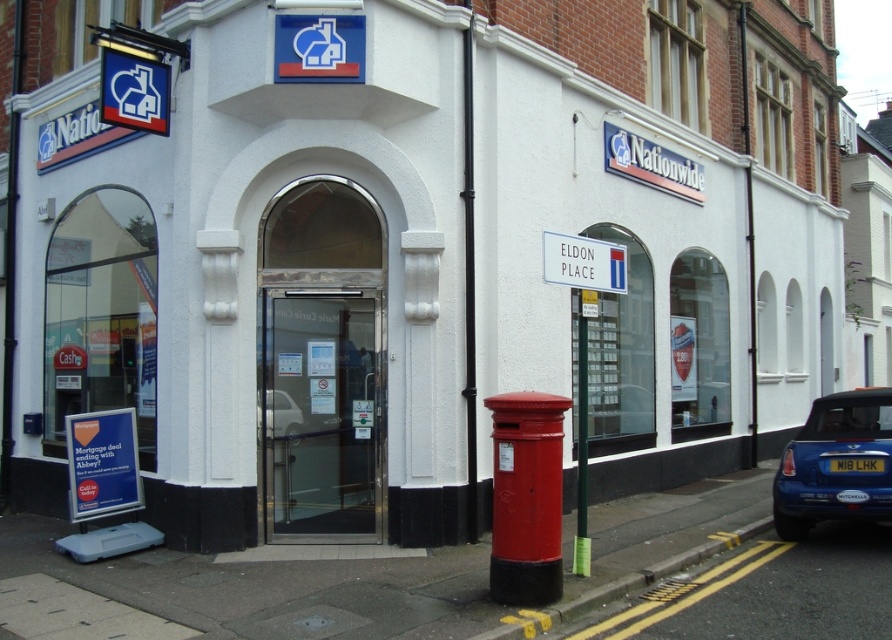
You are a delivery driver who needs to park your vehicle. You see a blue metallic car at lower right and a white glossy car at center. Which car takes up more space in the parking area?

The blue metallic car at lower right is larger in size than the white glossy car at center, so it takes up more space in the parking area.

You are a delivery person needing to park your 5.5 meter long truck. You see a blue metallic car at lower right and a white glossy car at center. Is there enough space between them to park your truck?

The blue metallic car at lower right is 4.75 meters from the white glossy car at center. Since your truck is 5.5 meters long, the space between them is insufficient. You cannot park your truck there.

You are standing in front of the Nationwide branch entrance and want to locate two points marked on the building facade. The first point is at coordinates point (475, 448) and the second is at point (833, 468). Which point is closer to your current position?

Point (475, 448) is closer to your current position because it is further to the camera than point (833, 468).